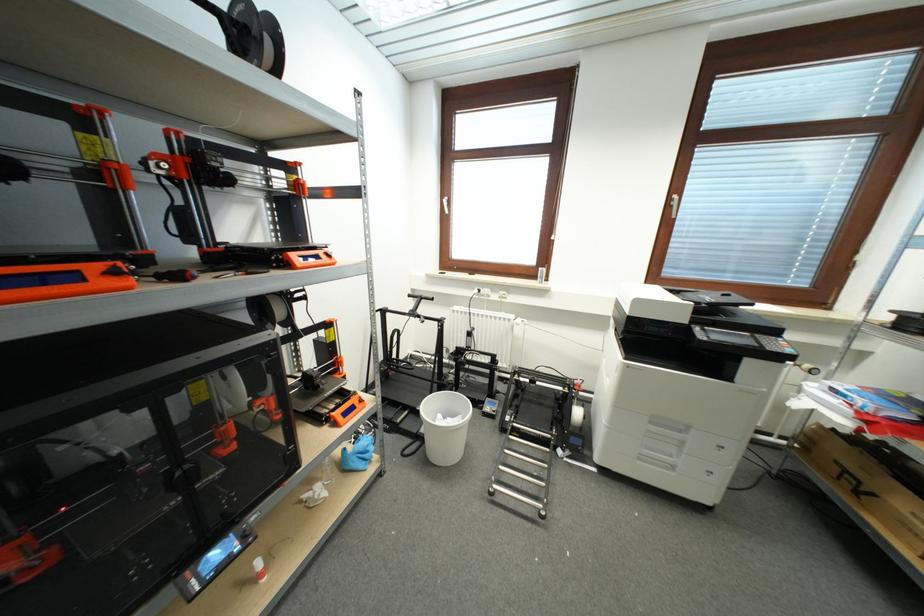
This screenshot has width=924, height=616. Describe the element at coordinates (674, 205) in the screenshot. I see `a silver window handle` at that location.